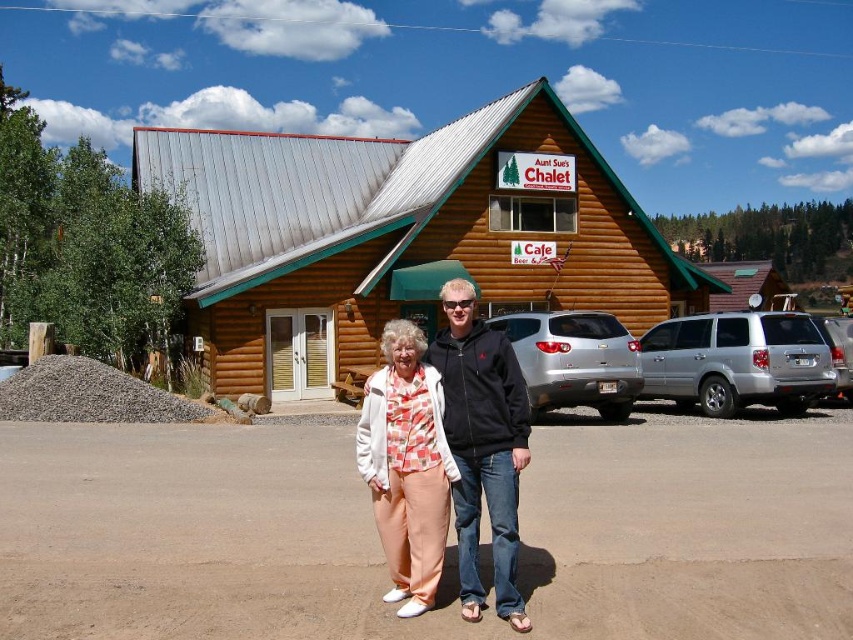
You are standing at the point marked by coordinates point (399, 236). Looking around, what structure would you see directly in front of you?

The point (399, 236) marks the brown log cabin at center, so you would see the brown log cabin at center directly in front of you.